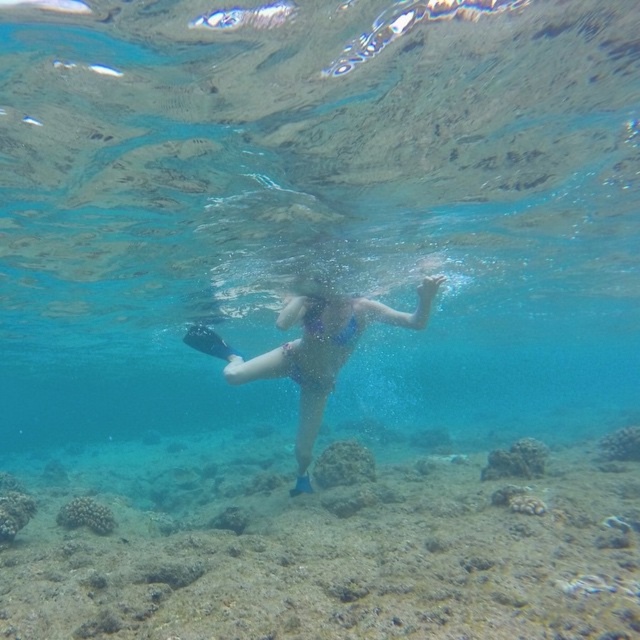
You are a marine biologist planning to dive between the clear blue water at center and the rough textured coral reef at center. Given that your diving equipment has a maximum safe operating distance of 40 feet between two points, will you be able to safely navigate between them?

The clear blue water at center and rough textured coral reef at center are 41.95 feet apart from each other, which exceeds the diving equipment maximum safe operating distance of 40 feet. Therefore, it is not safe to navigate between them.

Based on the photo, you are a marine biologist observing the underwater scene. You notice the rough textured coral reef at center and the blue matte swimsuit at center. Which object is shorter in height?

The rough textured coral reef at center has a lesser height compared to the blue matte swimsuit at center, so the rough textured coral reef at center is shorter.